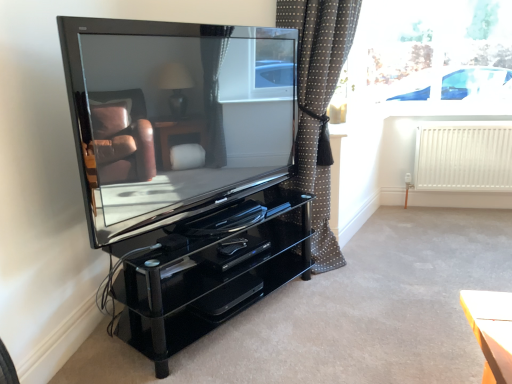
Question: From a real-world perspective, is glossy black television at center above or below polka dot fabric curtain at center?

Choices:
 (A) below
 (B) above

Answer: (B)

Question: Considering the positions of glossy black television at center and polka dot fabric curtain at center in the image, is glossy black television at center bigger or smaller than polka dot fabric curtain at center?

Choices:
 (A) big
 (B) small

Answer: (B)

Question: Which is farther from the glossy black television at center?

Choices:
 (A) polka dot fabric curtain at center
 (B) black glossy dvd player at center
 (C) white matte radiator at right
 (D) transparent glass window at upper right

Answer: (C)

Question: Which is nearer to the white matte radiator at right?

Choices:
 (A) glossy black television at center
 (B) polka dot fabric curtain at center
 (C) transparent glass window at upper right
 (D) black glossy dvd player at center

Answer: (C)